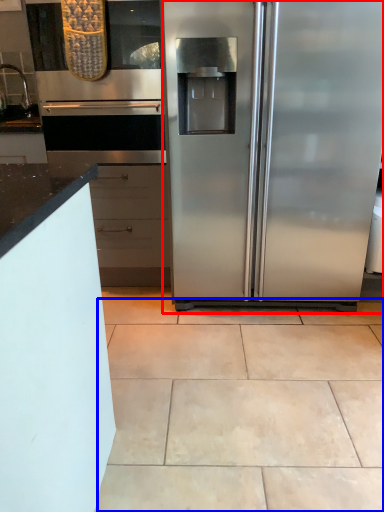
Question: Which of the following is the farthest to the observer, refrigerator (highlighted by a red box) or ceramic tile (highlighted by a blue box)?

Choices:
 (A) refrigerator
 (B) ceramic tile

Answer: (A)